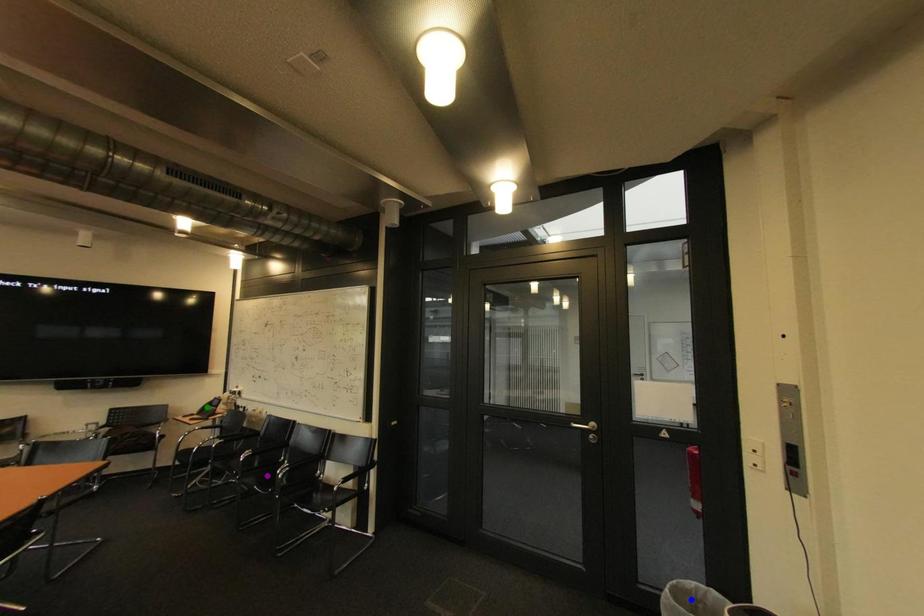
Order these from nearest to farthest:
purple point | green point | blue point

1. blue point
2. purple point
3. green point